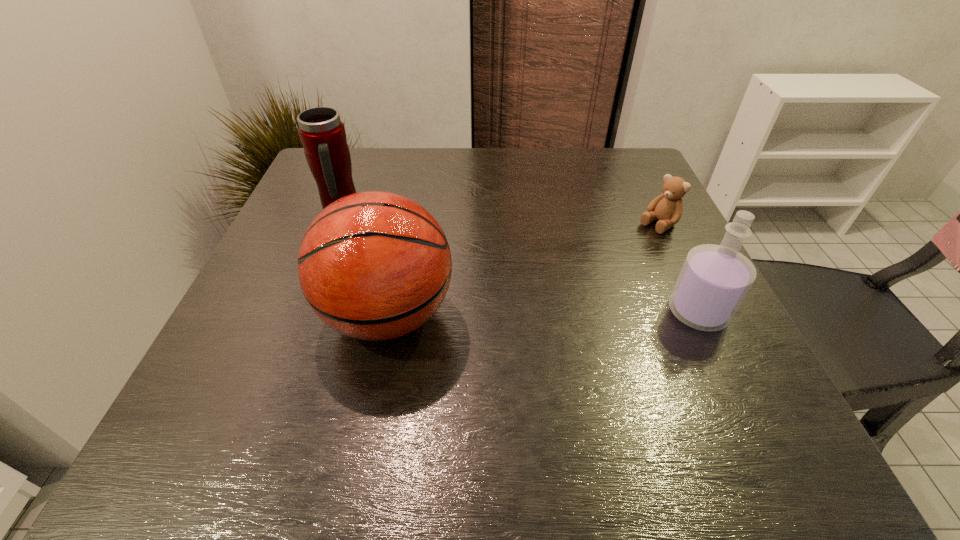
Locate an element on the screen. The height and width of the screenshot is (540, 960). free space that satisfies the following two spatial constraints: 1. on the back side of the perfume; 2. on the left side of the shortest object is located at coordinates (657, 225).

Find the location of `vacant area in the image that satisfies the following two spatial constraints: 1. on the front side of the thermos bottle; 2. on the side with spill of the basketball`. vacant area in the image that satisfies the following two spatial constraints: 1. on the front side of the thermos bottle; 2. on the side with spill of the basketball is located at coordinates (x=297, y=315).

Where is `free space that satisfies the following two spatial constraints: 1. on the front side of the shortest object; 2. on the left side of the thermos bottle`? free space that satisfies the following two spatial constraints: 1. on the front side of the shortest object; 2. on the left side of the thermos bottle is located at coordinates (333, 225).

You are a GUI agent. You are given a task and a screenshot of the screen. Output one action in this format:
    pyautogui.click(x=<x>, y=<y>)
    Task: Click on the free space that satisfies the following two spatial constraints: 1. on the front side of the thermos bottle; 2. on the left side of the perfume
    
    Given the screenshot: What is the action you would take?
    pyautogui.click(x=299, y=312)

What are the coordinates of `vacant space that satisfies the following two spatial constraints: 1. on the front side of the thermos bottle; 2. on the right side of the shortest object` in the screenshot? It's located at (333, 225).

I want to click on vacant space that satisfies the following two spatial constraints: 1. on the front side of the basketball; 2. on the side with spill of the thermos bottle, so click(297, 315).